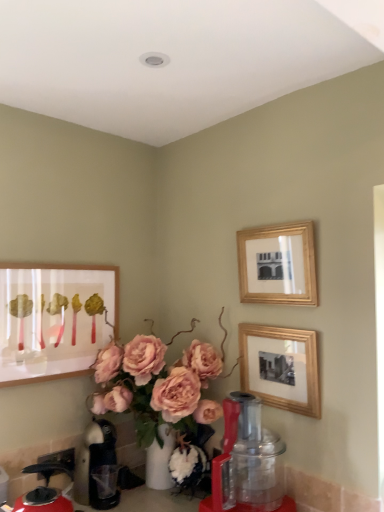
Question: Based on their positions, is red plastic blender at lower center located to the left or right of pink matte floral arrangement at center?

Choices:
 (A) right
 (B) left

Answer: (A)

Question: From a real-world perspective, relative to pink matte floral arrangement at center, is red plastic blender at lower center vertically above or below?

Choices:
 (A) above
 (B) below

Answer: (B)

Question: Which of these objects is positioned closest to the shiny red coffee pot at lower left, placed as the first coffeepot when sorted from front to back?

Choices:
 (A) pink matte floral arrangement at center
 (B) wooden picture frame at center-right, which is the third picture frame from left to right
 (C) red plastic blender at lower center
 (D) metallic silver coffee pot at lower left, the second coffeepot viewed from the front
 (E) matte wooden picture frame at left, which is counted as the first picture frame, starting from the left

Answer: (D)

Question: Considering the real-world distances, which object is farthest from the metallic silver coffee pot at lower left, the second coffeepot viewed from the front?

Choices:
 (A) shiny red coffee pot at lower left, placed as the first coffeepot when sorted from front to back
 (B) wooden picture frame at center-right, which is the third picture frame from left to right
 (C) pink matte floral arrangement at center
 (D) gold/glass picture frame at upper right, which ranks as the second picture frame in right-to-left order
 (E) matte wooden picture frame at left, which ranks as the third picture frame in right-to-left order

Answer: (D)